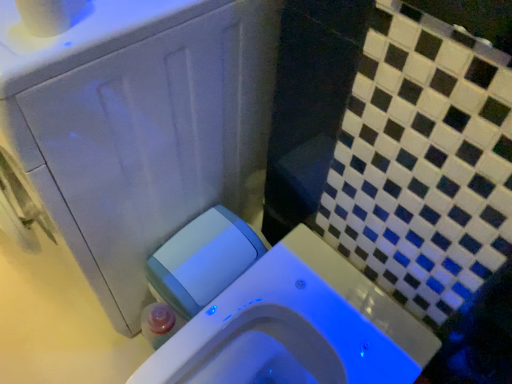
Question: Is white plastic water tank at lower left surrounding white matte toilet paper at upper left?

Choices:
 (A) yes
 (B) no

Answer: (B)

Question: Does white plastic water tank at lower left have a greater width compared to white matte toilet paper at upper left?

Choices:
 (A) no
 (B) yes

Answer: (B)

Question: Considering the relative sizes of white plastic water tank at lower left and white matte toilet paper at upper left in the image provided, is white plastic water tank at lower left bigger than white matte toilet paper at upper left?

Choices:
 (A) yes
 (B) no

Answer: (A)

Question: Is white plastic water tank at lower left to the left of white matte toilet paper at upper left from the viewer's perspective?

Choices:
 (A) yes
 (B) no

Answer: (B)

Question: Does white plastic water tank at lower left turn towards white matte toilet paper at upper left?

Choices:
 (A) yes
 (B) no

Answer: (B)

Question: From the image's perspective, is white plastic water tank at lower left located above white matte toilet paper at upper left?

Choices:
 (A) no
 (B) yes

Answer: (A)

Question: Can you confirm if white glossy toilet at center is wider than white plastic water tank at lower left?

Choices:
 (A) yes
 (B) no

Answer: (A)

Question: Is white glossy toilet at center looking in the opposite direction of white plastic water tank at lower left?

Choices:
 (A) no
 (B) yes

Answer: (A)

Question: Can you confirm if white glossy toilet at center is taller than white plastic water tank at lower left?

Choices:
 (A) yes
 (B) no

Answer: (A)

Question: Is white glossy toilet at center positioned behind white plastic water tank at lower left?

Choices:
 (A) yes
 (B) no

Answer: (B)

Question: From a real-world perspective, does white glossy toilet at center sit lower than white plastic water tank at lower left?

Choices:
 (A) no
 (B) yes

Answer: (A)

Question: Is white glossy toilet at center far from white plastic water tank at lower left?

Choices:
 (A) no
 (B) yes

Answer: (A)

Question: Is white plastic water tank at lower left far from white glossy toilet at center?

Choices:
 (A) no
 (B) yes

Answer: (A)